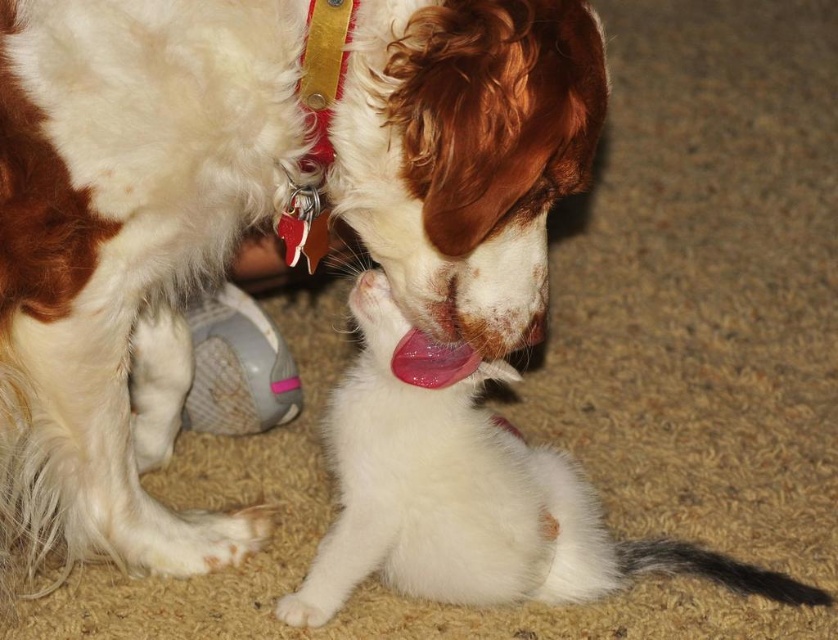
Which is below, white fluffy dog at center or pink glossy tongue at center?

pink glossy tongue at center is below.

Is the position of white fluffy dog at center less distant than that of pink glossy tongue at center?

That is True.

Where is `white fluffy dog at center`? white fluffy dog at center is located at coordinates (249, 214).

Who is more forward, (79, 486) or (365, 275)?

Point (365, 275)

In the scene shown: Is white fluffy dog at center to the right of pink glossy nose at center from the viewer's perspective?

In fact, white fluffy dog at center is to the left of pink glossy nose at center.

Does point (37, 344) come behind point (365, 276)?

No, it is in front of (365, 276).

Image resolution: width=838 pixels, height=640 pixels. In order to click on white fluffy dog at center in this screenshot , I will do `click(249, 214)`.

Is point (416, 348) farther from camera compared to point (376, 269)?

No, (416, 348) is closer to viewer.

Consider the image. Does pink glossy tongue at center have a greater width compared to pink glossy nose at center?

Yes, pink glossy tongue at center is wider than pink glossy nose at center.

Between point (443, 348) and point (366, 273), which one is positioned behind?

The point (366, 273) is behind.

Where is `pink glossy tongue at center`? This screenshot has width=838, height=640. pink glossy tongue at center is located at coordinates (432, 360).